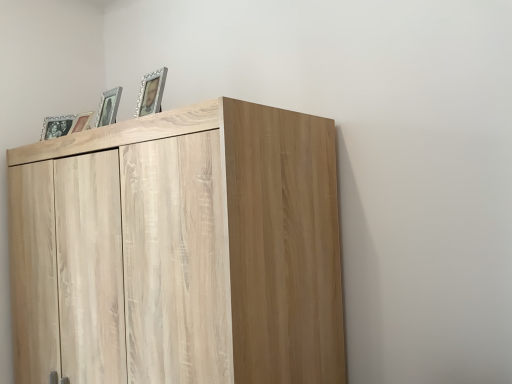
Question: From their relative heights in the image, would you say matte wooden picture frame at upper left, which appears as the second picture frame when viewed from the back, is taller or shorter than light wood cupboard at upper left?

Choices:
 (A) tall
 (B) short

Answer: (B)

Question: Is matte wooden picture frame at upper left, the 3th picture frame when ordered from right to left, spatially inside light wood cupboard at upper left, or outside of it?

Choices:
 (A) outside
 (B) inside

Answer: (A)

Question: Which of these objects is positioned farthest from the matte black picture frame at upper left, which is the fourth picture frame in right-to-left order?

Choices:
 (A) silver metallic photo frame at upper center, which is the 1th picture frame in front-to-back order
 (B) light wood cupboard at upper left
 (C) matte wooden picture frame at upper left, which is the 2th picture frame from left to right
 (D) matte silver picture frame at upper left, which ranks as the 2th picture frame in front-to-back order

Answer: (B)

Question: Estimate the real-world distances between objects in this image. Which object is farther from the light wood cupboard at upper left?

Choices:
 (A) matte wooden picture frame at upper left, which appears as the second picture frame when viewed from the back
 (B) matte black picture frame at upper left, which is the first picture frame from left to right
 (C) matte silver picture frame at upper left, which appears as the third picture frame when viewed from the back
 (D) silver metallic photo frame at upper center, marked as the 4th picture frame in a left-to-right arrangement

Answer: (B)